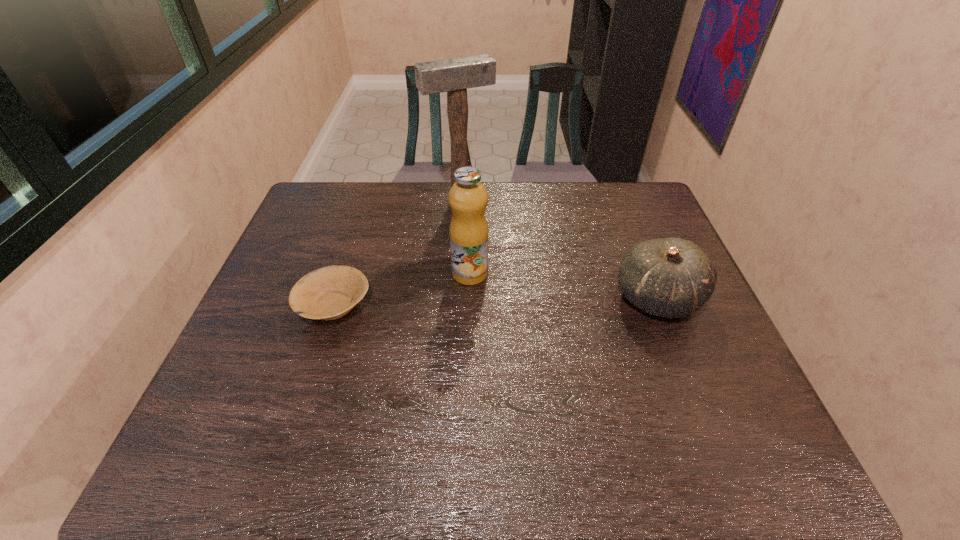
This screenshot has height=540, width=960. Find the location of `the shortest object`. the shortest object is located at coordinates (328, 293).

Identify the location of the leftmost object. The image size is (960, 540). (328, 293).

Locate an element on the screen. This screenshot has height=540, width=960. the rightmost object is located at coordinates (671, 277).

Find the location of a particular element. Image resolution: width=960 pixels, height=540 pixels. the second shortest object is located at coordinates (671, 277).

Where is `the tallest object`? The width and height of the screenshot is (960, 540). the tallest object is located at coordinates 454,76.

What are the coordinates of `mallet` in the screenshot? It's located at (454, 76).

The image size is (960, 540). What are the coordinates of `fruit juice` in the screenshot? It's located at (469, 234).

This screenshot has height=540, width=960. Find the location of `free space located on the front of the leftmost object`. free space located on the front of the leftmost object is located at coordinates (306, 392).

Identify the location of vacant space positioned on the front of the gourd. Image resolution: width=960 pixels, height=540 pixels. (697, 397).

Image resolution: width=960 pixels, height=540 pixels. What are the coordinates of `vacant space situated 0.400m on the striking surface of the tallest object` in the screenshot? It's located at (525, 294).